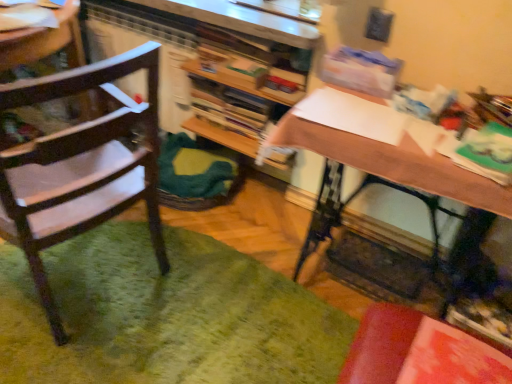
Question: Based on their positions, is green fuzzy mat at lower left located to the left or right of wooden chair at left?

Choices:
 (A) right
 (B) left

Answer: (A)

Question: Which is correct: green fuzzy mat at lower left is inside wooden chair at left, or outside of it?

Choices:
 (A) inside
 (B) outside

Answer: (B)

Question: Which of these objects is positioned farthest from the wooden desk at center?

Choices:
 (A) wooden chair at left
 (B) wooden bookshelf at center
 (C) green fuzzy mat at lower left

Answer: (C)

Question: Based on their relative distances, which object is nearer to the wooden desk at center?

Choices:
 (A) green fuzzy mat at lower left
 (B) wooden chair at left
 (C) wooden bookshelf at center

Answer: (C)